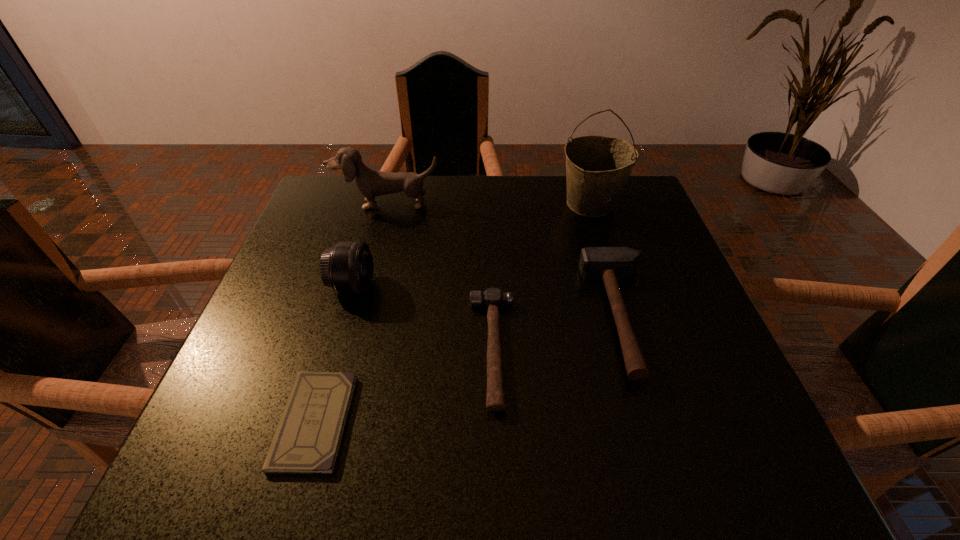
The width and height of the screenshot is (960, 540). I want to click on wine bucket, so click(x=597, y=167).

The image size is (960, 540). Identify the location of the second tallest object. (371, 183).

You are a GUI agent. You are given a task and a screenshot of the screen. Output one action in this format:
    pyautogui.click(x=<x>, y=<y>)
    Task: Click on the telephoto lens
    
    Given the screenshot: What is the action you would take?
    pyautogui.click(x=348, y=267)

The width and height of the screenshot is (960, 540). Identify the location of the taller hammer. (610, 264).

Where is `the right hammer`? the right hammer is located at coordinates (610, 264).

Where is `the fourth object from left to right`? The image size is (960, 540). the fourth object from left to right is located at coordinates (493, 298).

I want to click on the left hammer, so click(493, 298).

Find the location of a particular element. Image resolution: width=960 pixels, height=540 pixels. the shortest object is located at coordinates (307, 440).

Find the location of a particular element. The height and width of the screenshot is (540, 960). blank space located 0.350m on the front of the tallest object is located at coordinates (631, 331).

The image size is (960, 540). I want to click on vacant space situated at the face of the second tallest object, so click(366, 284).